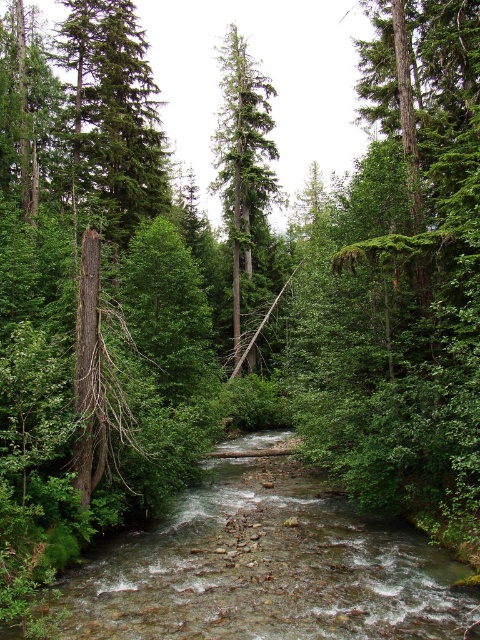
Question: From the image, what is the correct spatial relationship of green matte tree at left in relation to green matte tree at center?

Choices:
 (A) below
 (B) above

Answer: (A)

Question: Which is farther from the clear water at stream center?

Choices:
 (A) green matte tree at left
 (B) green matte tree at center

Answer: (B)

Question: Observing the image, what is the correct spatial positioning of green matte tree at left in reference to green matte tree at center?

Choices:
 (A) right
 (B) left

Answer: (B)

Question: Does clear water at stream center have a smaller size compared to green matte tree at center?

Choices:
 (A) yes
 (B) no

Answer: (A)

Question: Which is farther from the green matte tree at center?

Choices:
 (A) clear water at stream center
 (B) green matte tree at left

Answer: (A)

Question: Which point is closer to the camera?

Choices:
 (A) (123, 227)
 (B) (222, 86)

Answer: (A)